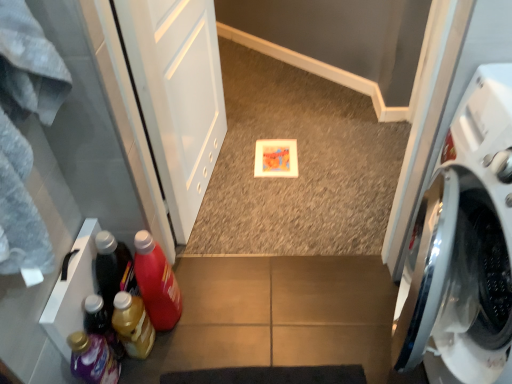
You are a GUI agent. You are given a task and a screenshot of the screen. Output one action in this format:
    pyautogui.click(x=<x>, y=<y>)
    Task: Click on the unoccupied region to the right of white glossy screen door at upper left
    
    Given the screenshot: What is the action you would take?
    pyautogui.click(x=293, y=173)